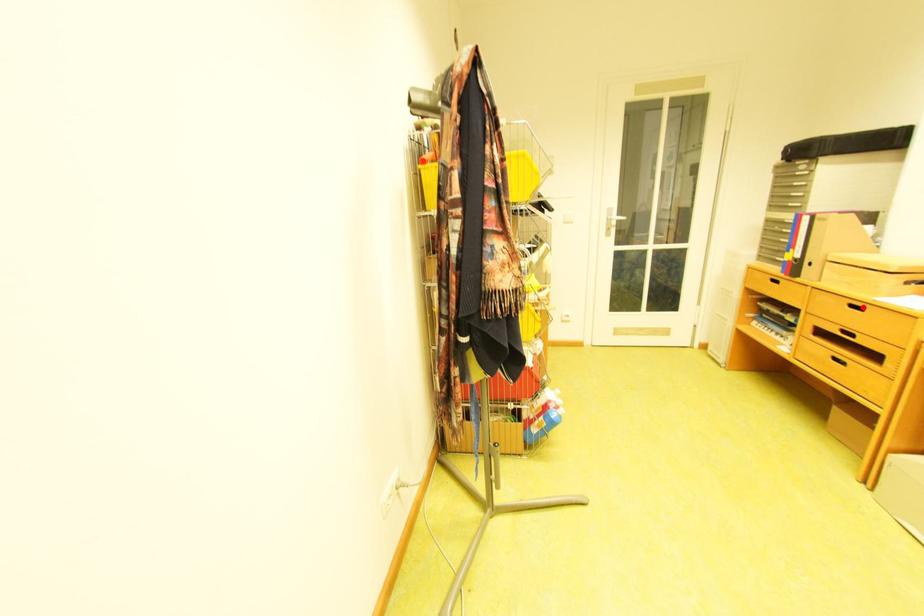
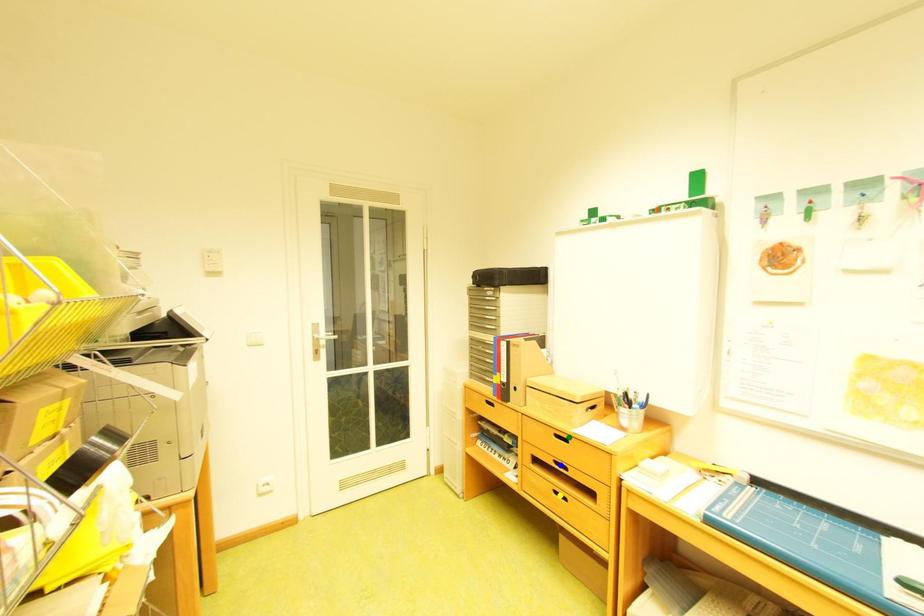
Question: I am providing you with two images of the same scene from different viewpoints. A red point is marked on the first image. You are given multiple points on the second image. Which point in image 2 is actually the same real-world point as the red point in image 1?

Choices:
 (A) yellow point
 (B) green point
 (C) blue point

Answer: (B)